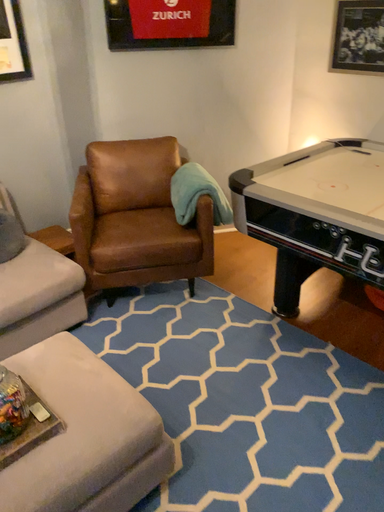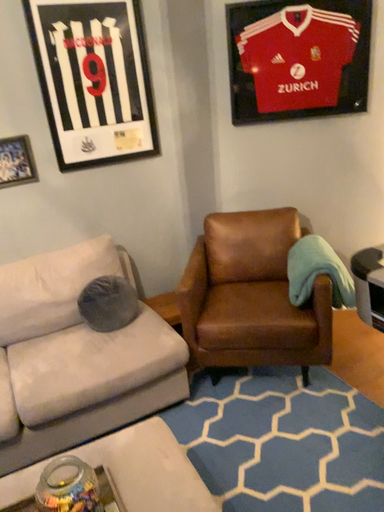
Question: How did the camera likely rotate when shooting the video?

Choices:
 (A) rotated upward
 (B) rotated downward

Answer: (A)